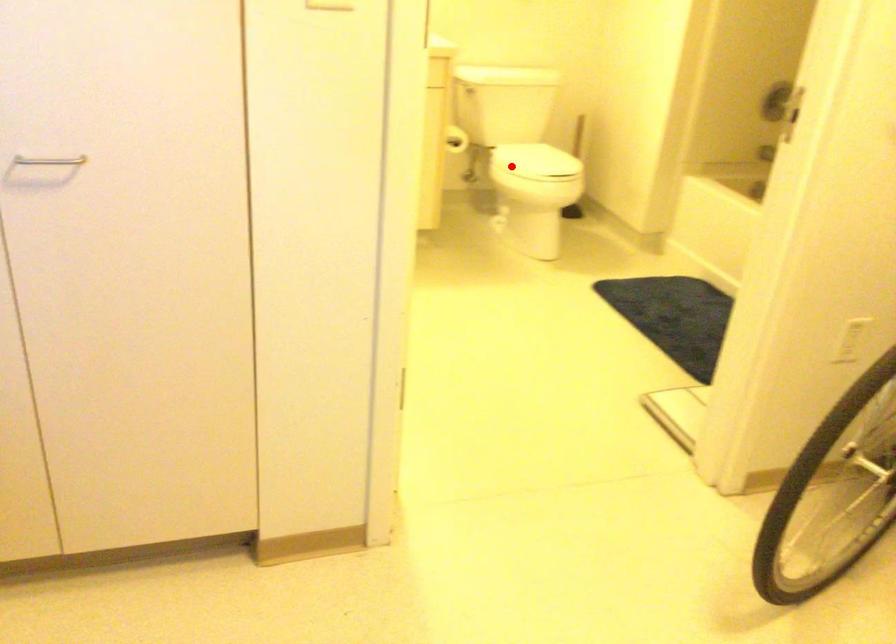
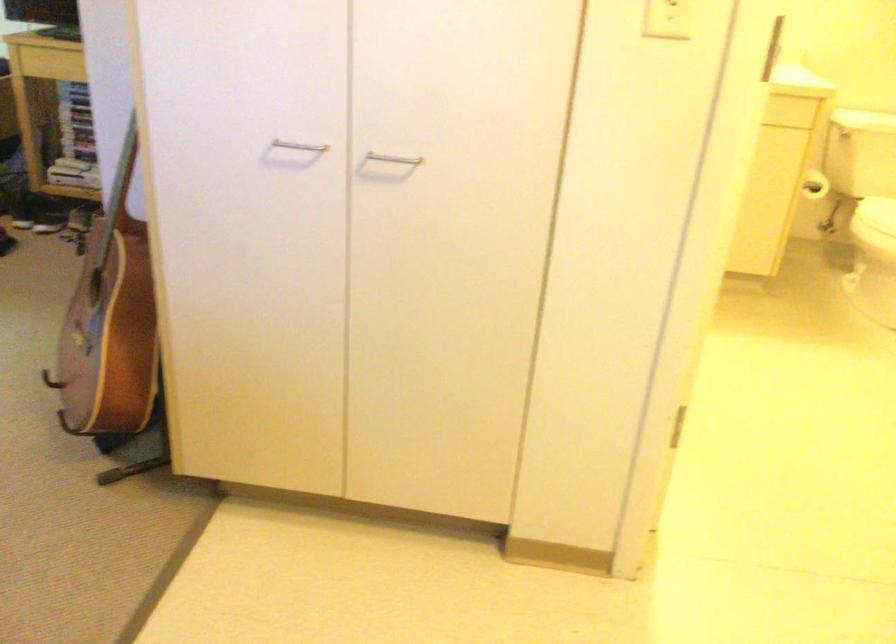
The point at the highlighted location is marked in the first image. Where is the corresponding point in the second image?

(876, 214)